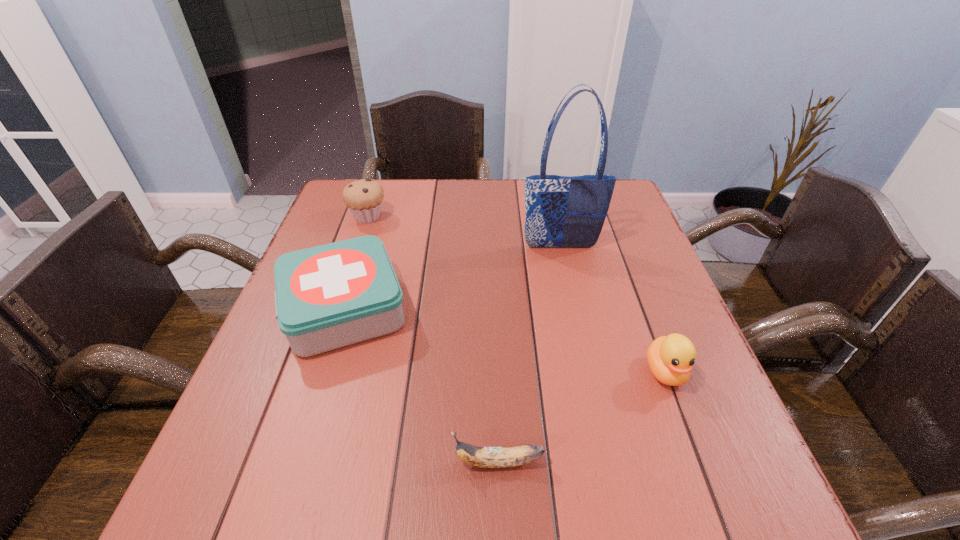
Identify the location of vacant space in between the fourth nearest object and the duckling. (612, 309).

This screenshot has height=540, width=960. I want to click on free space that is in between the duckling and the first-aid kit, so click(505, 341).

Where is `unoccupied area between the duckling and the muffin`? The image size is (960, 540). unoccupied area between the duckling and the muffin is located at coordinates (516, 294).

Locate an element on the screen. free area in between the fourth nearest object and the banana is located at coordinates (529, 354).

You are a GUI agent. You are given a task and a screenshot of the screen. Output one action in this format:
    pyautogui.click(x=<x>, y=<y>)
    Task: Click on the vacant point located between the first-aid kit and the rightmost object
    Image resolution: width=960 pixels, height=540 pixels.
    Given the screenshot: What is the action you would take?
    point(505,341)

I want to click on vacant space in between the duckling and the shopping bag, so click(x=612, y=309).

Identify the location of free spot between the first-aid kit and the duckling. (505, 341).

The width and height of the screenshot is (960, 540). I want to click on free space that is in between the shortest object and the duckling, so click(582, 417).

Where is `object that stands as the fourth closest to the shopping bag`? The height and width of the screenshot is (540, 960). object that stands as the fourth closest to the shopping bag is located at coordinates (485, 457).

Select which object is the second closest to the first-aid kit. Please provide its 2D coordinates. Your answer should be formatted as a tuple, i.e. [(x, y)], where the tuple contains the x and y coordinates of a point satisfying the conditions above.

[(485, 457)]